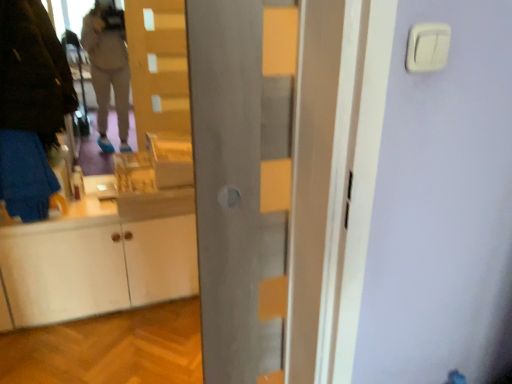
Question: From their relative heights in the image, would you say white plastic light switch at upper right is taller or shorter than dark brown leather jacket at left?

Choices:
 (A) tall
 (B) short

Answer: (B)

Question: In the image, is white plastic light switch at upper right on the left side or the right side of dark brown leather jacket at left?

Choices:
 (A) left
 (B) right

Answer: (B)

Question: Which object is the farthest from the white plastic light switch at upper right?

Choices:
 (A) metallic gray door at center
 (B) dark brown leather jacket at left

Answer: (B)

Question: Which is farther from the dark brown leather jacket at left?

Choices:
 (A) metallic gray door at center
 (B) white plastic light switch at upper right

Answer: (B)